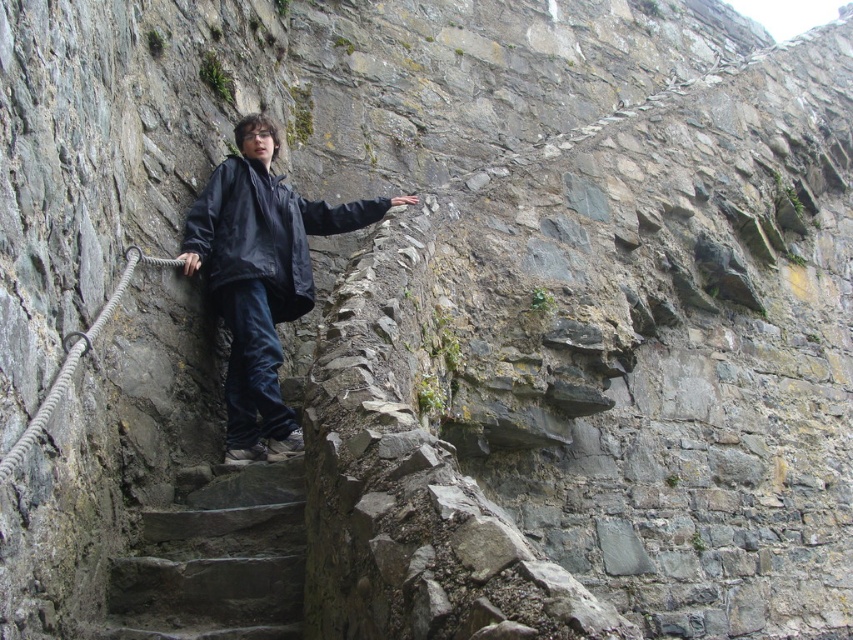
Is dark blue jacket at center below dark blue matte jacket at center?

Yes, dark blue jacket at center is below dark blue matte jacket at center.

Is point (199, 236) positioned after point (270, 221)?

No, it is not.

Which is in front, point (300, 301) or point (323, 234)?

Point (300, 301)

This screenshot has width=853, height=640. Identify the location of dark blue jacket at center. (260, 278).

Which is behind, point (263, 246) or point (108, 589)?

Positioned behind is point (263, 246).

Where is `dark blue jacket at center`? This screenshot has width=853, height=640. dark blue jacket at center is located at coordinates (260, 278).

Which of these two, gray stone stairs at center or dark blue matte jacket at center, stands taller?

dark blue matte jacket at center is taller.

Does gray stone stairs at center appear over dark blue matte jacket at center?

Incorrect, gray stone stairs at center is not positioned above dark blue matte jacket at center.

Between point (286, 522) and point (213, 252), which one is positioned in front?

Positioned in front is point (286, 522).

Where is `gray stone stairs at center`? The height and width of the screenshot is (640, 853). gray stone stairs at center is located at coordinates (216, 561).